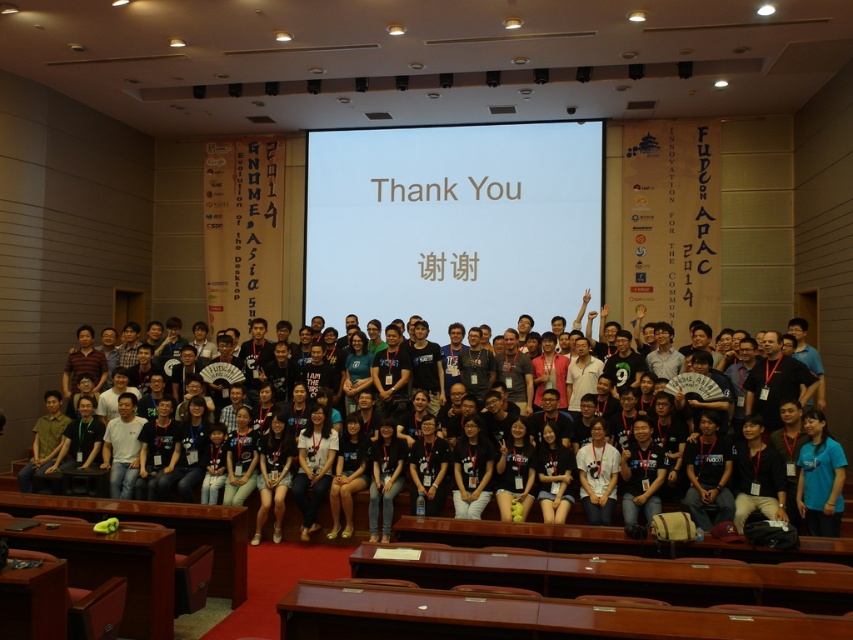
Is black fabric shirt at center bigger than blue fabric shirt at lower right?

Yes.

Does black fabric shirt at center appear on the left side of blue fabric shirt at lower right?

Indeed, black fabric shirt at center is positioned on the left side of blue fabric shirt at lower right.

Between point (38, 308) and point (819, 474), which one is positioned in front?

Point (819, 474) is more forward.

At what (x,y) coordinates should I click in order to perform the action: click on black fabric shirt at center. Please return your answer as a coordinate pair (x, y). Looking at the image, I should click on (38, 340).

Between white matte projection screen at center and dark blue t-shirt at center, which one appears on the left side from the viewer's perspective?

dark blue t-shirt at center is more to the left.

Which is behind, point (421, 152) or point (282, 426)?

Positioned behind is point (421, 152).

Is point (569, 305) closer to camera compared to point (260, 477)?

No.

What are the coordinates of `white matte projection screen at center` in the screenshot? It's located at (453, 224).

Which is more to the right, white matte projection screen at center or black fabric shirt at center?

Positioned to the right is white matte projection screen at center.

Does white matte projection screen at center appear under black fabric shirt at center?

No, white matte projection screen at center is not below black fabric shirt at center.

Locate an element on the screen. This screenshot has width=853, height=640. white matte projection screen at center is located at coordinates (453, 224).

Where is `white matte projection screen at center`? white matte projection screen at center is located at coordinates (453, 224).